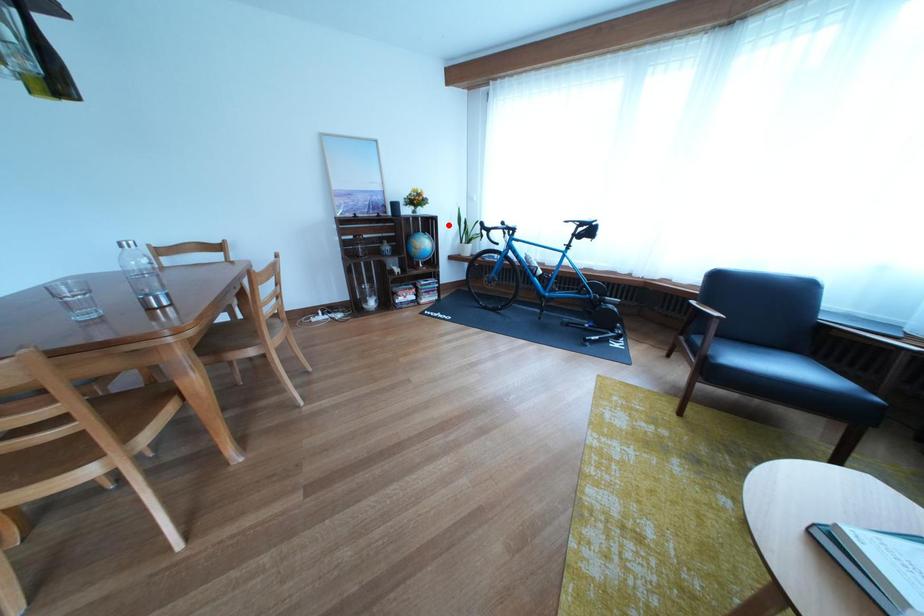
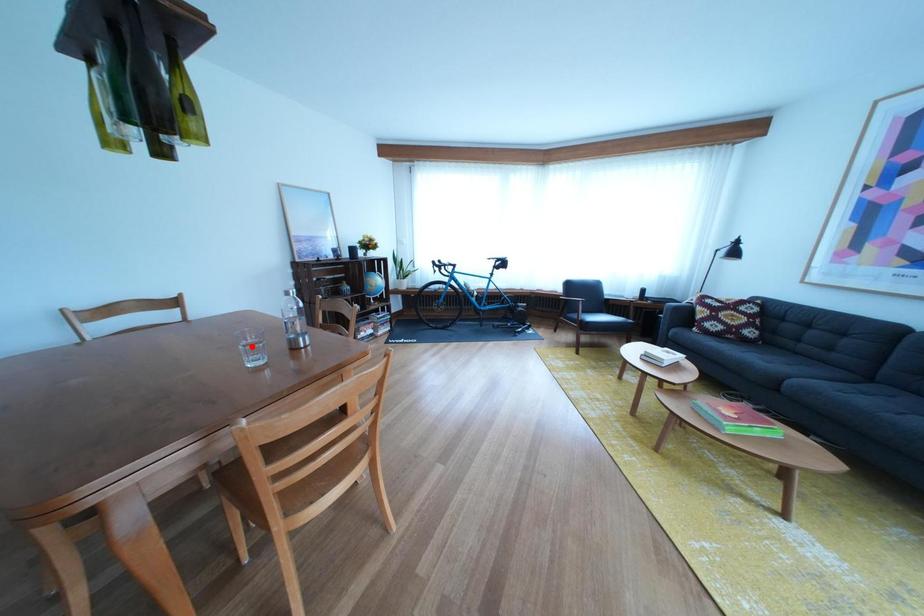
I am providing you with two images of the same scene from different viewpoints. A red point is marked on the first image and another point is marked on the second image. Does the point marked in image1 correspond to the same location as the one in image2?

No